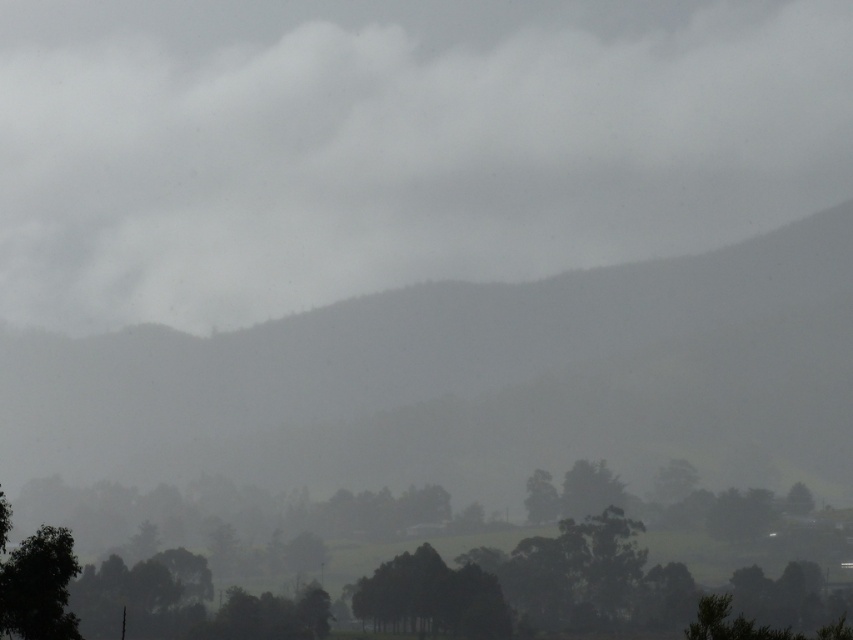
Question: Does gray matte mountain at center have a greater width compared to green matte tree at center?

Choices:
 (A) no
 (B) yes

Answer: (B)

Question: Which point appears farthest from the camera in this image?

Choices:
 (A) (287, 218)
 (B) (15, 621)
 (C) (805, 509)
 (D) (91, 627)

Answer: (A)

Question: Which object is positioned farthest from the green matte tree at lower center?

Choices:
 (A) green matte tree at center
 (B) green leafy tree at lower left

Answer: (B)

Question: Is green leafy tree at lower left to the left of green matte tree at center from the viewer's perspective?

Choices:
 (A) no
 (B) yes

Answer: (B)

Question: Can you confirm if gray matte mountain at center is smaller than green matte tree at lower center?

Choices:
 (A) yes
 (B) no

Answer: (B)

Question: Which point appears closest to the camera in this image?

Choices:
 (A) (795, 508)
 (B) (547, 68)

Answer: (A)